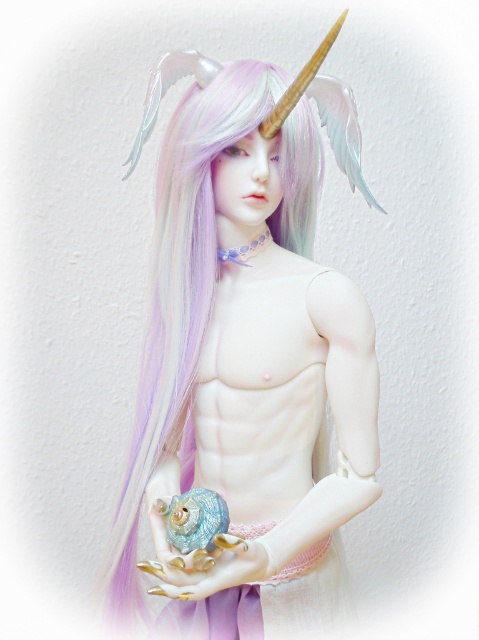
Question: Does pastel matte unicorn horn at upper center have a lesser width compared to gold metallic nails at center?

Choices:
 (A) no
 (B) yes

Answer: (A)

Question: Can you confirm if pastel matte unicorn horn at upper center is positioned above gold metallic nails at center?

Choices:
 (A) yes
 (B) no

Answer: (A)

Question: Is pastel matte unicorn horn at upper center positioned in front of gold metallic nails at center?

Choices:
 (A) no
 (B) yes

Answer: (A)